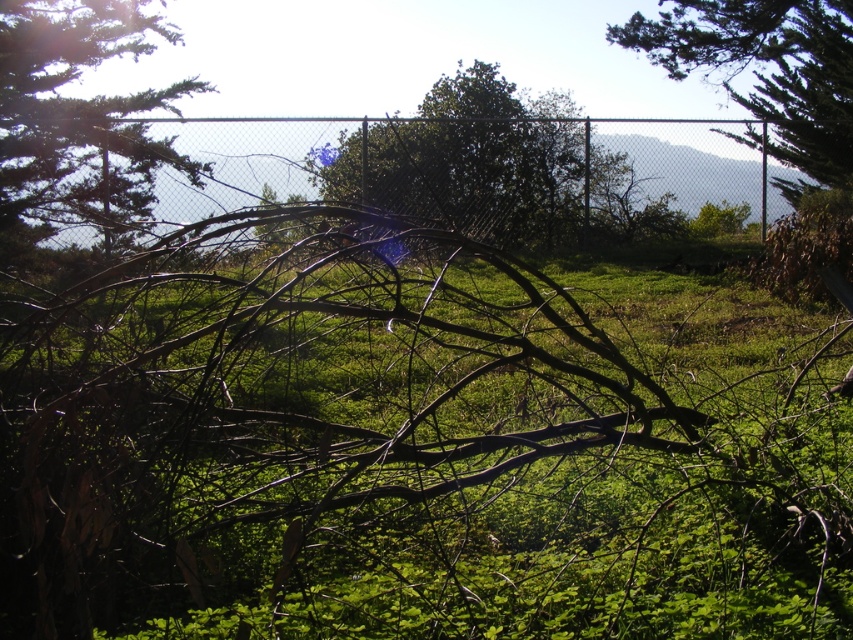
Question: Is green leafy tree at center bigger than green leafy tree at upper center?

Choices:
 (A) no
 (B) yes

Answer: (B)

Question: Is the position of metallic chain-link fence at center more distant than that of green leafy tree at upper left?

Choices:
 (A) no
 (B) yes

Answer: (A)

Question: Which object appears farthest from the camera in this image?

Choices:
 (A) green leafy tree at upper left
 (B) green matte grass at center
 (C) green leafy tree at center

Answer: (C)

Question: Which of these objects is positioned closest to the green matte grass at center?

Choices:
 (A) green leafy tree at upper center
 (B) green leafy tree at center
 (C) green leafy tree at upper left
 (D) metallic chain-link fence at center

Answer: (C)

Question: Can you confirm if green leafy tree at upper left is smaller than green leafy tree at upper center?

Choices:
 (A) yes
 (B) no

Answer: (B)

Question: Among these points, which one is nearest to the camera?

Choices:
 (A) (158, 147)
 (B) (769, 132)
 (C) (416, 490)

Answer: (C)